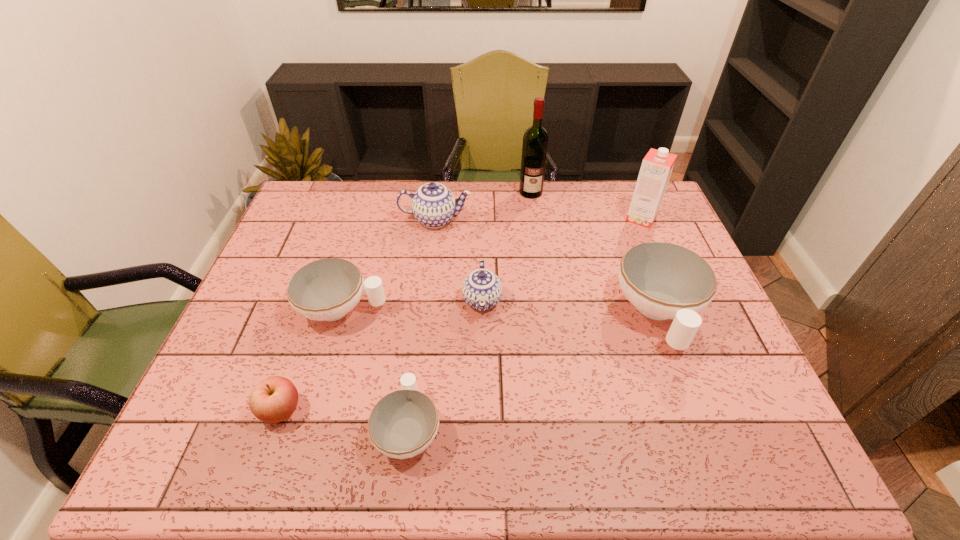
Where is `the nearest chinaware`? the nearest chinaware is located at coordinates pyautogui.click(x=402, y=424).

Where is `the smallest white chinaware`? The width and height of the screenshot is (960, 540). the smallest white chinaware is located at coordinates (402, 424).

In order to click on free spot located on the front and back of the farthest object in this screenshot , I will do `click(542, 271)`.

At what (x,y) coordinates should I click in order to perform the action: click on free space located 0.390m on the front of the seventh shortest object. Please return your answer as a coordinate pair (x, y). Image resolution: width=960 pixels, height=540 pixels. Looking at the image, I should click on (685, 323).

This screenshot has width=960, height=540. What are the coordinates of `free space located 0.300m at the spout of the farther blue chinaware` in the screenshot? It's located at (562, 220).

Identify the location of vacant region located on the side with the handle of the biggest white chinaware. (695, 414).

At what (x,y) coordinates should I click in order to perform the action: click on vacant space located at the spout of the nearer blue chinaware. Please return your answer as a coordinate pair (x, y). The height and width of the screenshot is (540, 960). Looking at the image, I should click on (483, 403).

Locate an element on the screen. free spot located 0.400m on the side with the handle of the second biggest white chinaware is located at coordinates (536, 309).

Locate an element on the screen. The image size is (960, 540). free spot located on the back of the red apple is located at coordinates (300, 354).

The image size is (960, 540). I want to click on vacant position located on the side with the handle of the second white chinaware from right to left, so click(422, 312).